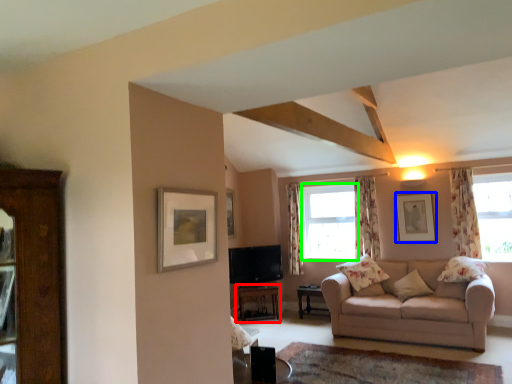
Question: Considering the real-world distances, which object is farthest from table (highlighted by a red box)? picture frame (highlighted by a blue box) or window (highlighted by a green box)?

Choices:
 (A) picture frame
 (B) window

Answer: (A)